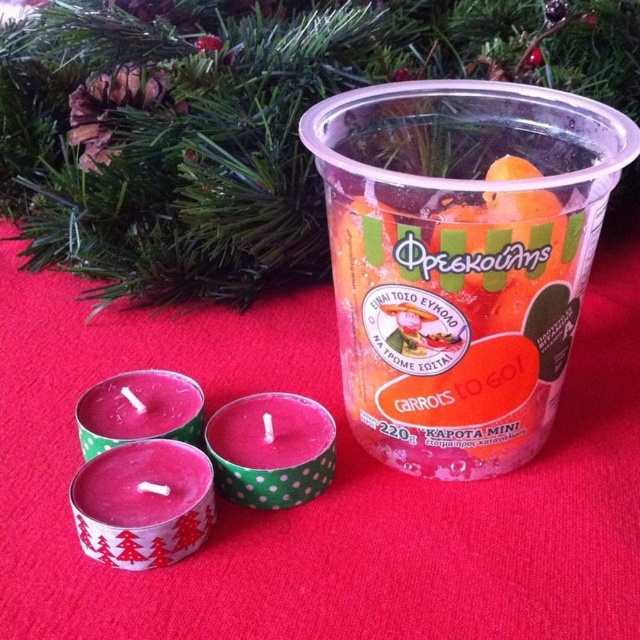
Question: Which point is farther from the camera taking this photo?

Choices:
 (A) (529, 369)
 (B) (260, 428)
 (C) (180, 496)

Answer: (B)

Question: Which point is farther to the camera?

Choices:
 (A) (225, 412)
 (B) (483, 387)
 (C) (132, 376)
 (D) (86, 500)

Answer: (C)

Question: Is translucent plastic cup at center positioned at the back of pink polka dot candle at center?

Choices:
 (A) yes
 (B) no

Answer: (B)

Question: Does matte pink candle at lower left come behind pink wax candle at center?

Choices:
 (A) yes
 (B) no

Answer: (B)

Question: Which is nearer to the matte pink candle at lower left?

Choices:
 (A) pink polka dot candle at center
 (B) translucent plastic cup at center
 (C) pink wax candle at center

Answer: (C)

Question: Is translucent plastic cup at center thinner than matte pink candle at lower left?

Choices:
 (A) no
 (B) yes

Answer: (A)